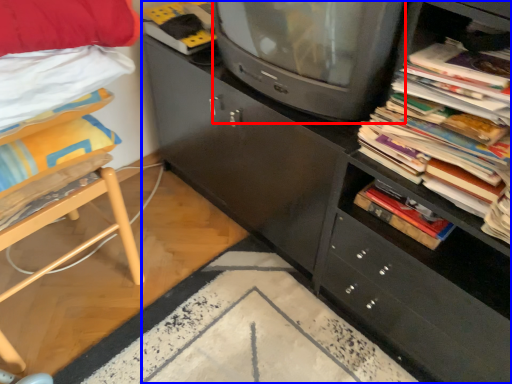
Question: Which object appears farthest to the camera in this image, television (highlighted by a red box) or cabinetry (highlighted by a blue box)?

Choices:
 (A) television
 (B) cabinetry

Answer: (A)